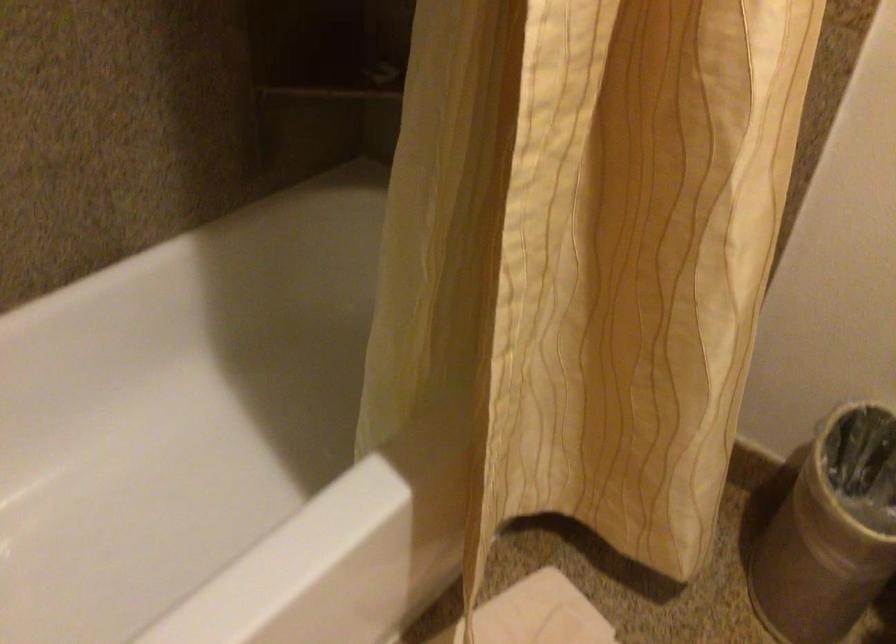
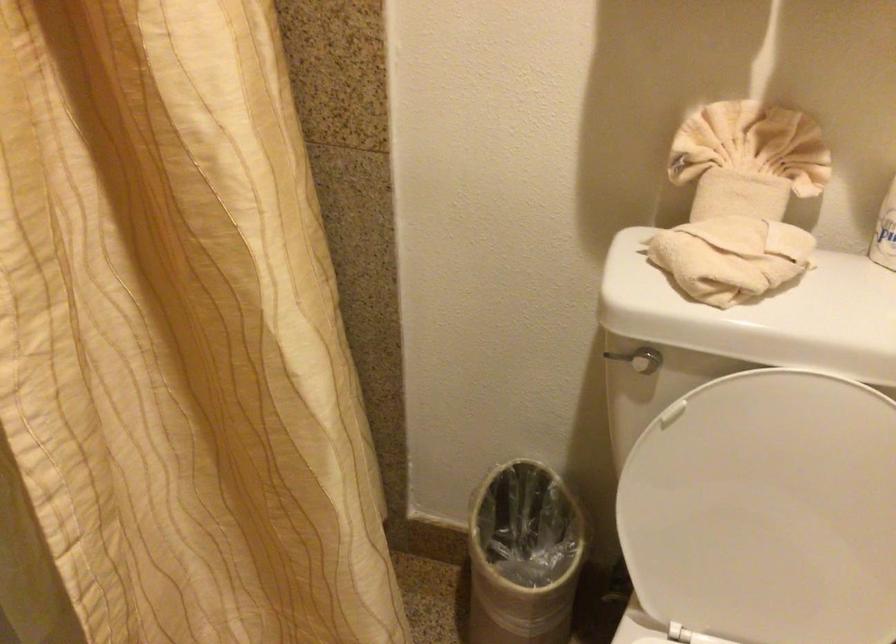
Question: Which direction would the cameraman need to move to produce the second image? Reply with the corresponding letter.

Choices:
 (A) Left
 (B) Right
 (C) Forward
 (D) Backward

Answer: (B)